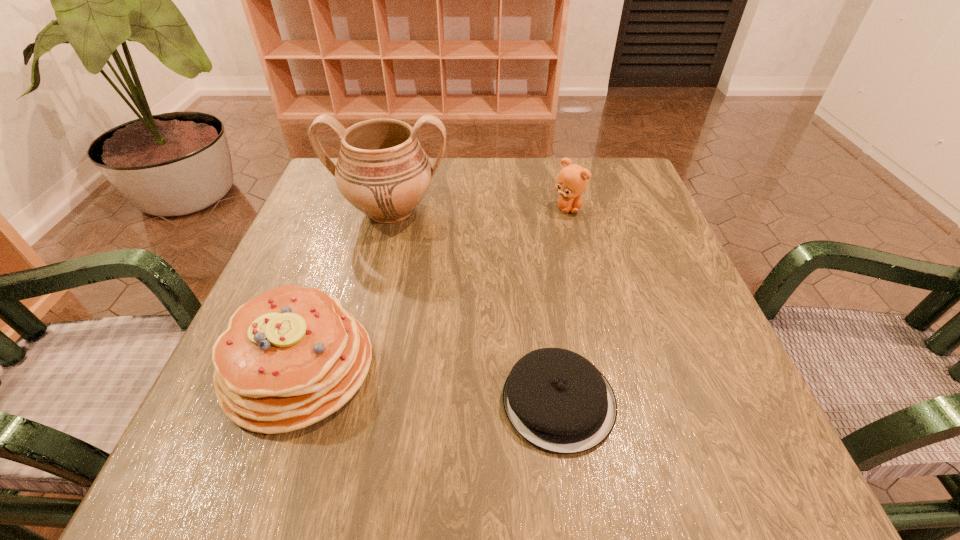
The width and height of the screenshot is (960, 540). Find the location of `vacant region between the shortest object and the left pancake`. vacant region between the shortest object and the left pancake is located at coordinates (429, 384).

Where is `object identified as the closest to the tallest object`? object identified as the closest to the tallest object is located at coordinates (290, 357).

Where is `object that is the second closest one to the tallest object`? This screenshot has width=960, height=540. object that is the second closest one to the tallest object is located at coordinates (572, 180).

The width and height of the screenshot is (960, 540). Identify the location of free location that satisfies the following two spatial constraints: 1. on the front-facing side of the shorter pancake; 2. on the left side of the tallest object. (344, 401).

Find the location of a particular element. vacant space that satisfies the following two spatial constraints: 1. on the front-facing side of the right pancake; 2. on the left side of the tallest object is located at coordinates (344, 401).